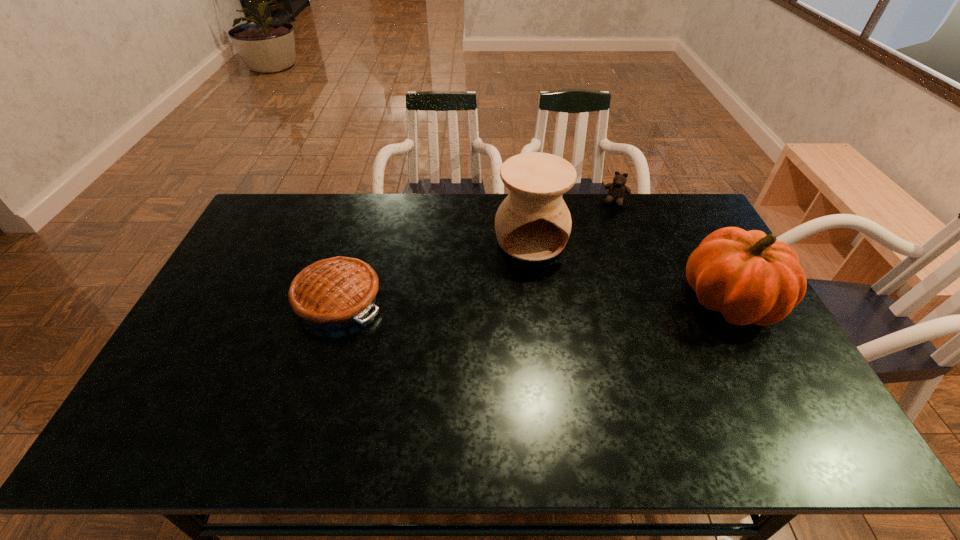
You are a GUI agent. You are given a task and a screenshot of the screen. Output one action in this format:
    pyautogui.click(x=<x>, y=<y>)
    Task: Click on the leftmost object
    
    Given the screenshot: What is the action you would take?
    pyautogui.click(x=332, y=293)

You are a GUI agent. You are given a task and a screenshot of the screen. Output one action in this format:
    pyautogui.click(x=<x>, y=<y>)
    Task: Click on the rightmost object
    
    Given the screenshot: What is the action you would take?
    pyautogui.click(x=750, y=277)

Locate an element on the screen. pottery is located at coordinates (533, 223).

This screenshot has width=960, height=540. In order to click on the third object from right to left in this screenshot , I will do `click(533, 223)`.

I want to click on the third object from left to right, so click(x=617, y=190).

What are the coordinates of `the farthest object` in the screenshot? It's located at (617, 190).

This screenshot has width=960, height=540. Identify the location of free space located 0.260m on the right of the pie. [x=470, y=300].

I want to click on vacant point located on the front of the pumpkin, so click(787, 406).

Locate an element on the screen. The image size is (960, 540). free space located 0.280m at the open side of the second farthest object is located at coordinates (557, 332).

This screenshot has width=960, height=540. What are the coordinates of `vacant space located 0.170m at the open side of the second farthest object` in the screenshot? It's located at (549, 302).